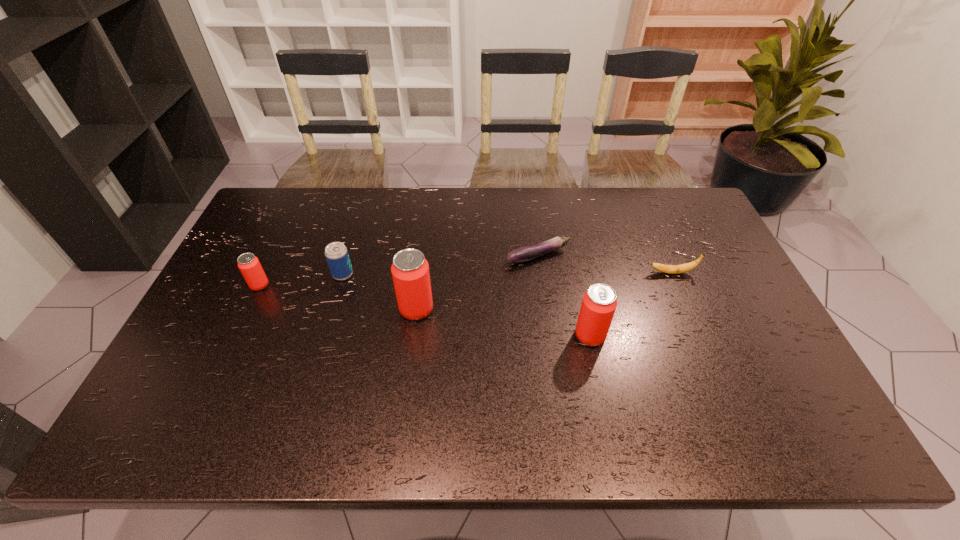
Where is `free spot located 0.050m on the back of the fourth object from right to left`? free spot located 0.050m on the back of the fourth object from right to left is located at coordinates (420, 284).

Where is `vacant region located on the left of the third shortest beer can`? vacant region located on the left of the third shortest beer can is located at coordinates (502, 336).

Where is `vacant space situated on the right of the shortest object`? This screenshot has height=540, width=960. vacant space situated on the right of the shortest object is located at coordinates (637, 256).

Image resolution: width=960 pixels, height=540 pixels. In order to click on vacant region located on the peel of the second shortest object from the top in this screenshot , I will do `click(570, 273)`.

Where is `free space located 0.260m on the peel of the second shortest object from the top`? free space located 0.260m on the peel of the second shortest object from the top is located at coordinates (561, 273).

I want to click on vacant space located on the peel of the second shortest object from the top, so point(597,273).

The width and height of the screenshot is (960, 540). In order to click on free space located on the front of the second beer can from left to right in this screenshot , I will do `click(334, 303)`.

Locate an element on the screen. The image size is (960, 540). object positioned at the left edge is located at coordinates click(249, 265).

The height and width of the screenshot is (540, 960). Find the location of `object present at the right edge`. object present at the right edge is located at coordinates (669, 269).

In the image, there is a desktop. Where is `vacant space at the far edge`? The width and height of the screenshot is (960, 540). vacant space at the far edge is located at coordinates coord(452,200).